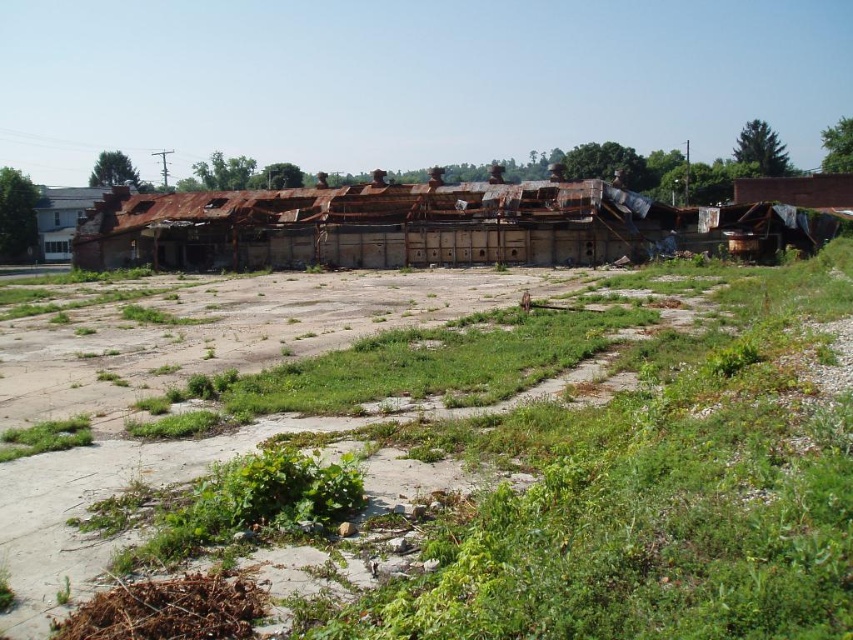
Who is more distant from viewer, (654, 504) or (585, 259)?

The point (585, 259) is more distant.

Where is `green grass at center`? Image resolution: width=853 pixels, height=640 pixels. green grass at center is located at coordinates (527, 477).

Which is behind, point (363, 348) or point (103, 268)?

Positioned behind is point (103, 268).

The image size is (853, 640). In order to click on green grass at center in this screenshot , I will do `click(527, 477)`.

From the picture: Does green grass at center have a smaller size compared to white painted wood house at left?

Yes, green grass at center is smaller than white painted wood house at left.

Can you confirm if green grass at center is taller than white painted wood house at left?

No.

Which is behind, point (849, 476) or point (67, 198)?

Point (67, 198)

Find the location of a particular element. This screenshot has height=640, width=853. green grass at center is located at coordinates (527, 477).

Does rusty metal building at center have a smaller size compared to white painted wood house at left?

Correct, rusty metal building at center occupies less space than white painted wood house at left.

What do you see at coordinates (376, 225) in the screenshot?
I see `rusty metal building at center` at bounding box center [376, 225].

Does point (196, 212) lie behind point (97, 196)?

No, (196, 212) is closer to viewer.

This screenshot has height=640, width=853. Identify the location of rusty metal building at center. (376, 225).